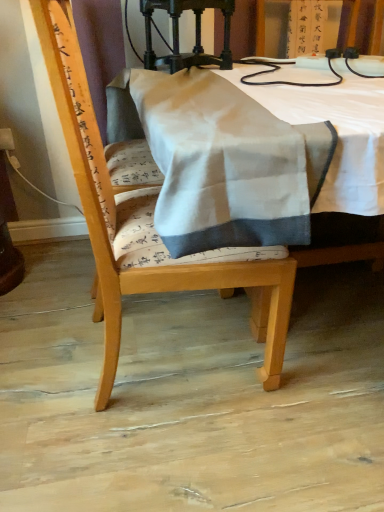
Question: Is wooden chair at center in contact with polished dark wood lamp at upper center?

Choices:
 (A) yes
 (B) no

Answer: (B)

Question: Is wooden chair at center further to the viewer compared to polished dark wood lamp at upper center?

Choices:
 (A) yes
 (B) no

Answer: (B)

Question: Is polished dark wood lamp at upper center located within wooden chair at center?

Choices:
 (A) yes
 (B) no

Answer: (B)

Question: Is there a large distance between wooden chair at center and polished dark wood lamp at upper center?

Choices:
 (A) yes
 (B) no

Answer: (B)

Question: Is wooden chair at center to the left of polished dark wood lamp at upper center from the viewer's perspective?

Choices:
 (A) yes
 (B) no

Answer: (A)

Question: Considering the positions of point (198, 40) and point (355, 180), is point (198, 40) closer or farther from the camera than point (355, 180)?

Choices:
 (A) farther
 (B) closer

Answer: (A)

Question: Is polished dark wood lamp at upper center to the left or to the right of white fabric at center in the image?

Choices:
 (A) right
 (B) left

Answer: (B)

Question: Considering the positions of polished dark wood lamp at upper center and white fabric at center in the image, is polished dark wood lamp at upper center taller or shorter than white fabric at center?

Choices:
 (A) tall
 (B) short

Answer: (B)

Question: From the image's perspective, is polished dark wood lamp at upper center located above or below white fabric at center?

Choices:
 (A) above
 (B) below

Answer: (A)

Question: From the image's perspective, relative to polished dark wood lamp at upper center, is wooden chair at center above or below?

Choices:
 (A) below
 (B) above

Answer: (A)

Question: From a real-world perspective, is wooden chair at center positioned above or below polished dark wood lamp at upper center?

Choices:
 (A) below
 (B) above

Answer: (A)

Question: Choose the correct answer: Is wooden chair at center inside polished dark wood lamp at upper center or outside it?

Choices:
 (A) outside
 (B) inside

Answer: (A)

Question: Considering the positions of wooden chair at center and polished dark wood lamp at upper center in the image, is wooden chair at center bigger or smaller than polished dark wood lamp at upper center?

Choices:
 (A) big
 (B) small

Answer: (A)

Question: Considering the positions of point (228, 12) and point (61, 124), is point (228, 12) closer or farther from the camera than point (61, 124)?

Choices:
 (A) farther
 (B) closer

Answer: (A)

Question: Looking at the image, does polished dark wood lamp at upper center seem bigger or smaller compared to wooden chair at center?

Choices:
 (A) big
 (B) small

Answer: (B)